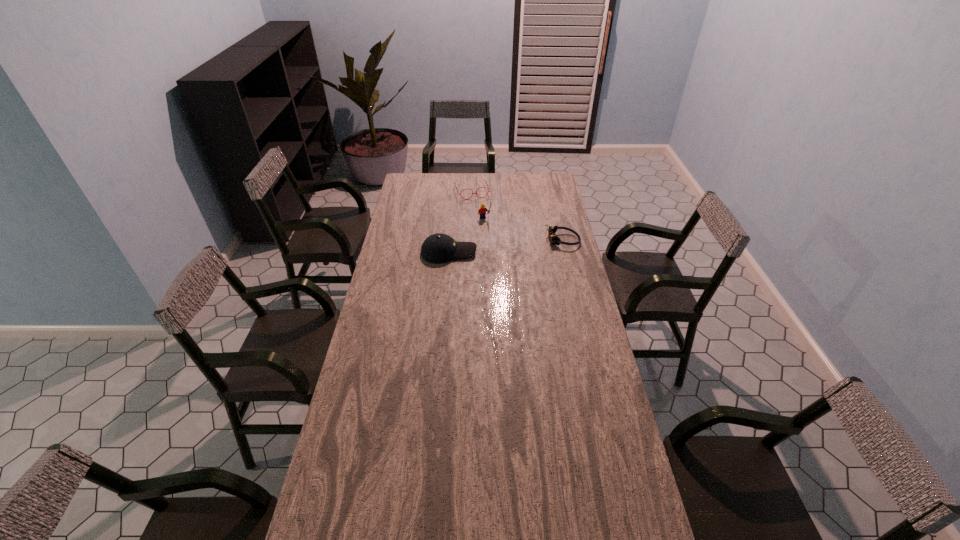
The image size is (960, 540). In order to click on vacant area that lies between the goggles and the baseball cap in this screenshot , I will do `click(506, 246)`.

Where is `vacant space that is in between the second tallest object and the tallest object`? Image resolution: width=960 pixels, height=540 pixels. vacant space that is in between the second tallest object and the tallest object is located at coordinates (467, 236).

This screenshot has width=960, height=540. I want to click on free point between the second tallest object and the spectacles, so click(460, 221).

The image size is (960, 540). I want to click on free space between the farthest object and the second farthest object, so click(x=478, y=205).

The width and height of the screenshot is (960, 540). Identify the location of vacant space that's between the spectacles and the tallest object. (478, 205).

Locate an element on the screen. The width and height of the screenshot is (960, 540). free spot between the farthest object and the Lego is located at coordinates (478, 205).

I want to click on vacant space that is in between the baseball cap and the farthest object, so click(460, 221).

Locate an element on the screen. empty space between the spectacles and the second farthest object is located at coordinates (478, 205).

This screenshot has width=960, height=540. In order to click on object that is the third closest one to the goggles in this screenshot , I will do `click(483, 180)`.

Where is `object identified as the third closest to the third shortest object`? The height and width of the screenshot is (540, 960). object identified as the third closest to the third shortest object is located at coordinates (483, 180).